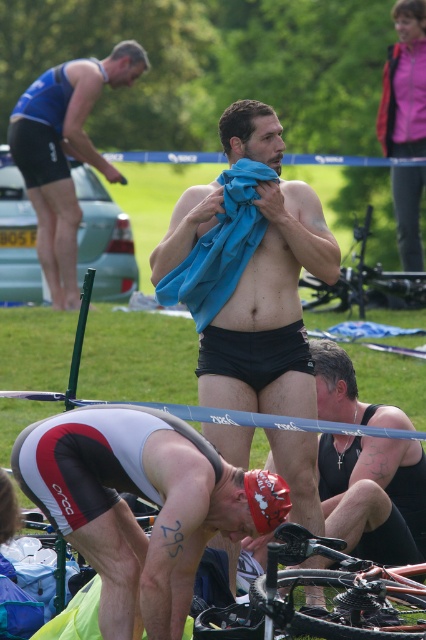
In the scene shown: Who is lower down, white matte cycling shorts at lower left or matte blue shorts at upper left?

white matte cycling shorts at lower left is below.

Is point (284, 508) in front of point (65, 289)?

Yes, it is in front of point (65, 289).

Between point (233, 502) and point (43, 154), which one is positioned in front?

Point (233, 502)

Locate an element on the screen. white matte cycling shorts at lower left is located at coordinates (143, 497).

Is black matte tank top at lower right below shiny metallic bicycle at lower center?

No, black matte tank top at lower right is not below shiny metallic bicycle at lower center.

Locate an element on the screen. The height and width of the screenshot is (640, 426). black matte tank top at lower right is located at coordinates (374, 493).

Consider the image. Can you confirm if white matte cycling shorts at lower left is positioned to the left of black matte tank top at lower right?

Yes, white matte cycling shorts at lower left is to the left of black matte tank top at lower right.

Describe the element at coordinates (143, 497) in the screenshot. I see `white matte cycling shorts at lower left` at that location.

Which is in front, point (141, 612) or point (386, 554)?

Point (141, 612)

Identify the location of white matte cycling shorts at lower left. The width and height of the screenshot is (426, 640). (143, 497).